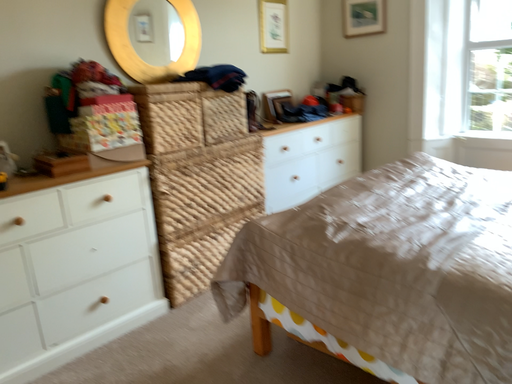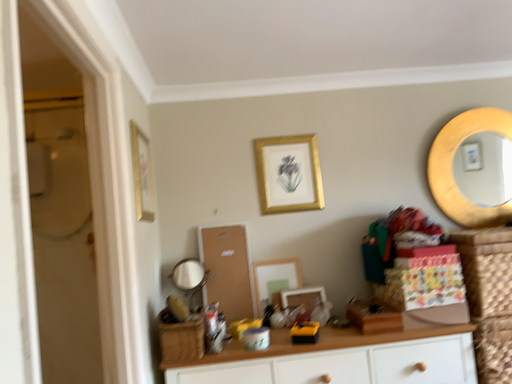
Question: How did the camera likely rotate when shooting the video?

Choices:
 (A) rotated downward
 (B) rotated upward

Answer: (B)